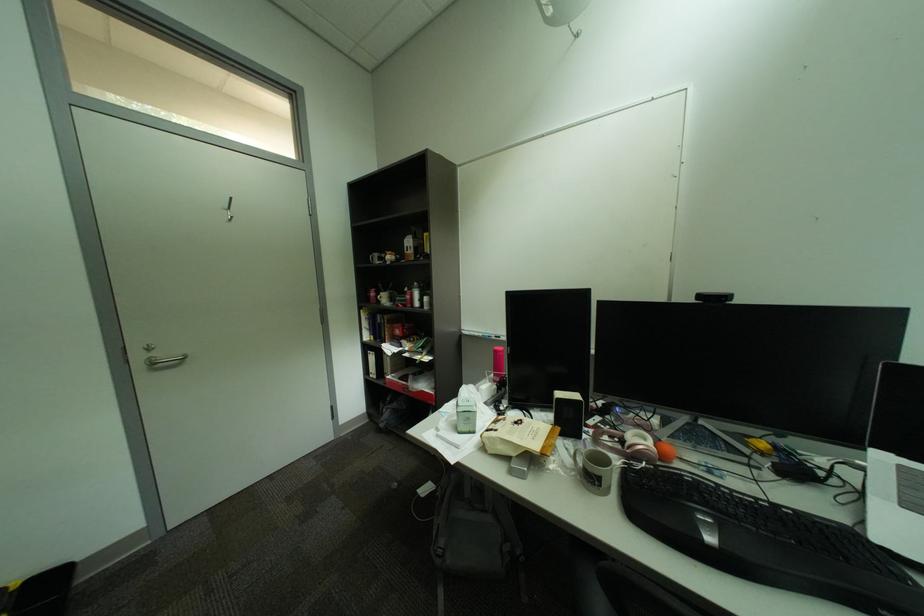
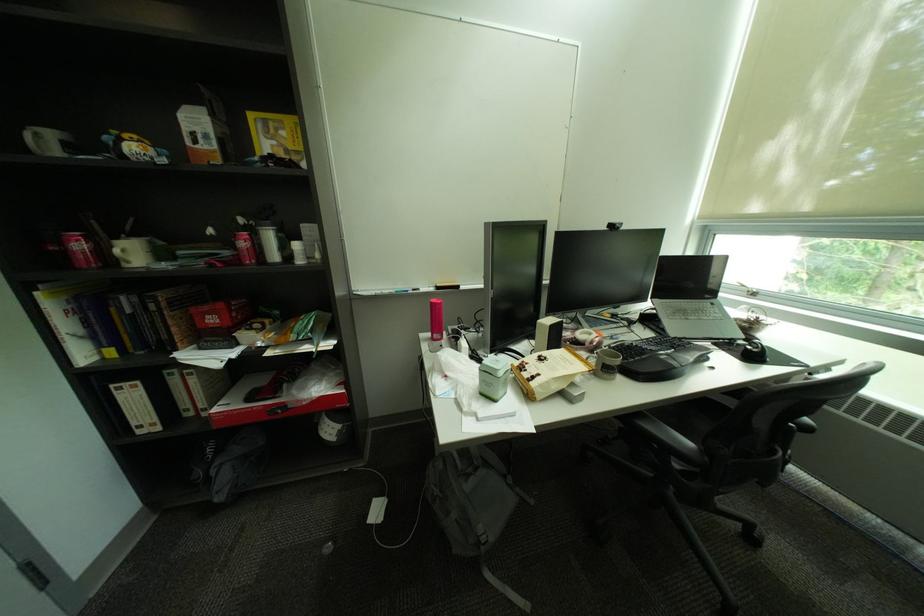
In the second image, find the point that corresponds to the point at 390,298 in the first image.

(128, 252)